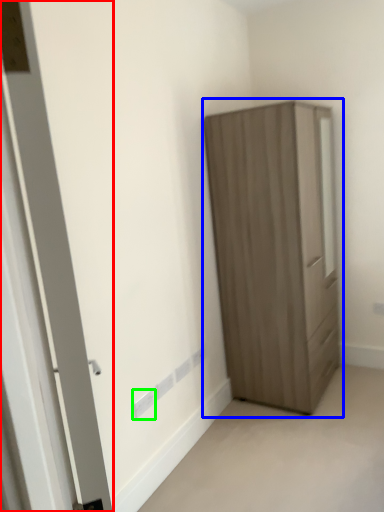
Question: Which object is positioned farthest from door (highlighted by a red box)? Select from cupboard (highlighted by a blue box) and electric outlet (highlighted by a green box).

Choices:
 (A) cupboard
 (B) electric outlet

Answer: (A)